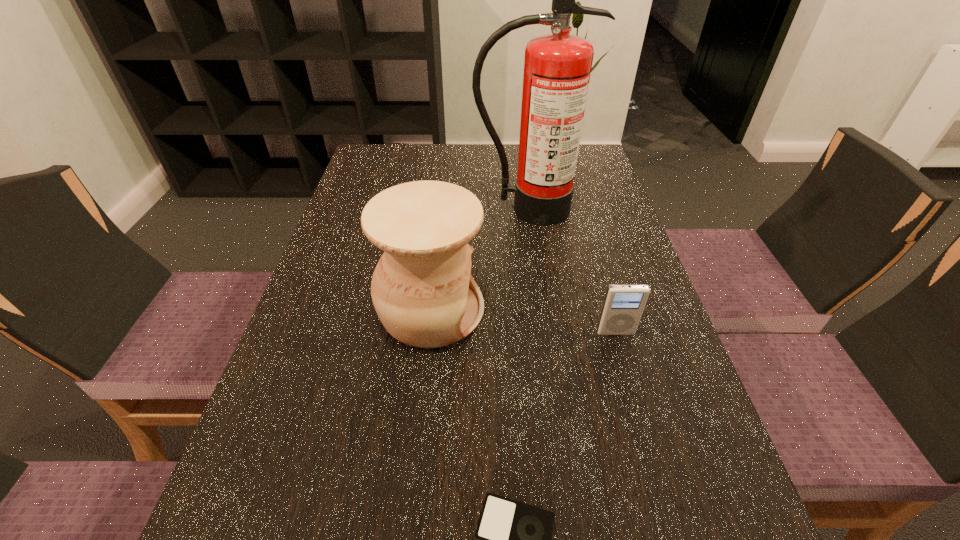
The image size is (960, 540). I want to click on vacant area between the taller iPod and the tallest object, so click(x=571, y=271).

Select which object is the second closest to the nearer iPod. Please provide its 2D coordinates. Your answer should be formatted as a tuple, i.e. [(x, y)], where the tuple contains the x and y coordinates of a point satisfying the conditions above.

[(623, 306)]

Where is `the closest object to the shorter iPod`? The height and width of the screenshot is (540, 960). the closest object to the shorter iPod is located at coordinates (422, 289).

At what (x,y) coordinates should I click in order to perform the action: click on vacant region that satisfies the following two spatial constraints: 1. on the front-facing side of the tallest object; 2. at the open side of the pottery. Please return your answer as a coordinate pair (x, y). The height and width of the screenshot is (540, 960). Looking at the image, I should click on (541, 310).

At what (x,y) coordinates should I click in order to perform the action: click on vacant area in the image that satisfies the following two spatial constraints: 1. on the front-facing side of the tallest object; 2. at the open side of the third shortest object. Please return your answer as a coordinate pair (x, y). This screenshot has height=540, width=960. Looking at the image, I should click on (541, 310).

Where is `free space that satisfies the following two spatial constraints: 1. on the front-facing side of the farthest object; 2. at the open side of the pottery`? free space that satisfies the following two spatial constraints: 1. on the front-facing side of the farthest object; 2. at the open side of the pottery is located at coordinates (541, 310).